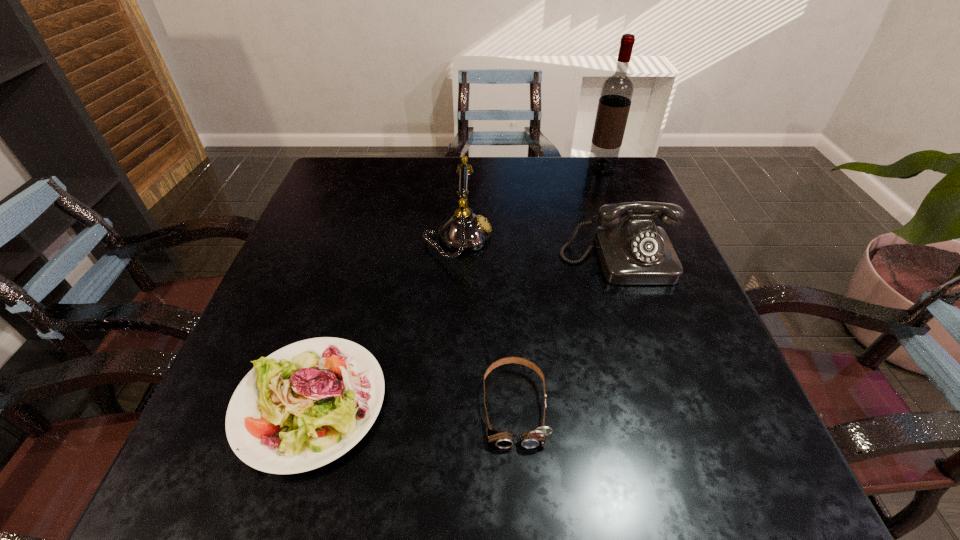
Where is `free space between the second tallest object and the salad plate`? This screenshot has width=960, height=540. free space between the second tallest object and the salad plate is located at coordinates (384, 320).

Find the location of a particular element. This screenshot has height=540, width=960. vacant area that lies between the farthest object and the taller telephone is located at coordinates (530, 202).

I want to click on free space between the taller telephone and the wine bottle, so click(530, 202).

This screenshot has width=960, height=540. I want to click on empty space that is in between the salad plate and the tallest object, so click(x=456, y=285).

Locate which object is the third closest to the goggles. Please provide its 2D coordinates. Your answer should be formatted as a tuple, i.e. [(x, y)], where the tuple contains the x and y coordinates of a point satisfying the conditions above.

[(464, 231)]

Select which object is the fourth closest to the salad plate. Please provide its 2D coordinates. Your answer should be formatted as a tuple, i.e. [(x, y)], where the tuple contains the x and y coordinates of a point satisfying the conditions above.

[(617, 90)]

At what (x,y) coordinates should I click in order to perform the action: click on blank space that satisfies the following two spatial constraints: 1. on the back side of the wine bottle; 2. on the left side of the salad plate. Please return your answer as a coordinate pair (x, y). Image resolution: width=960 pixels, height=540 pixels. Looking at the image, I should click on tap(382, 168).

You are a GUI agent. You are given a task and a screenshot of the screen. Output one action in this format:
    pyautogui.click(x=<x>, y=<y>)
    Task: Click on the free location that satisfies the following two spatial constraints: 1. on the dial of the taller telephone; 2. on the front side of the leftmost object
    
    Given the screenshot: What is the action you would take?
    pyautogui.click(x=448, y=402)